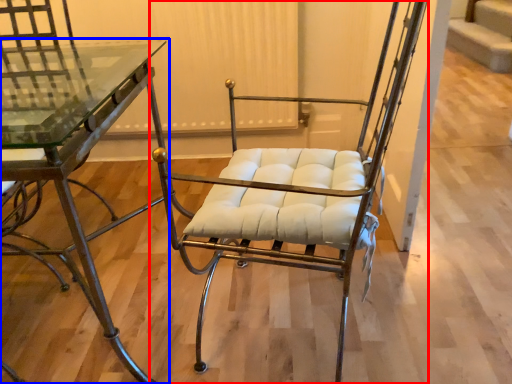
Question: Which point is closer to the camera, chair (highlighted by a red box) or table (highlighted by a blue box)?

Choices:
 (A) chair
 (B) table

Answer: (A)